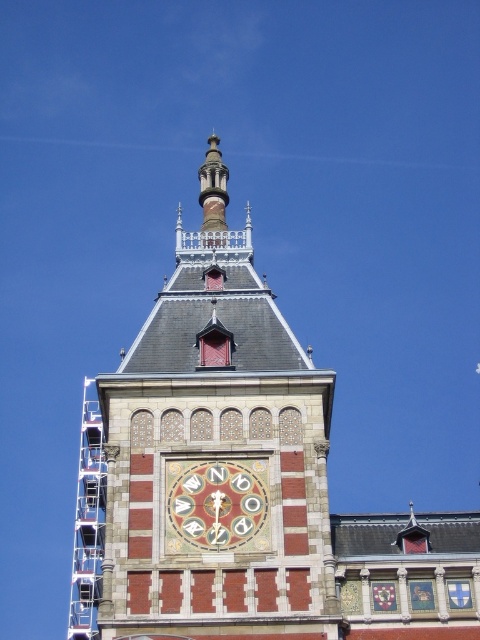
Can you confirm if brick clock tower at upper center is positioned below metal scaffolding at left?

Incorrect, brick clock tower at upper center is not positioned below metal scaffolding at left.

Is brick clock tower at upper center thinner than metal scaffolding at left?

No, brick clock tower at upper center is not thinner than metal scaffolding at left.

Which is in front, point (116, 520) or point (95, 598)?

Point (116, 520) is in front.

Find the location of a particular element. brick clock tower at upper center is located at coordinates (245, 464).

Does brick clock tower at upper center have a lesser width compared to marble clock face at center?

No.

The height and width of the screenshot is (640, 480). In order to click on brick clock tower at upper center in this screenshot , I will do (x=245, y=464).

Is marble clock face at center wider than metal scaffolding at left?

In fact, marble clock face at center might be narrower than metal scaffolding at left.

Does marble clock face at center have a lesser height compared to metal scaffolding at left?

Indeed, marble clock face at center has a lesser height compared to metal scaffolding at left.

You are a GUI agent. You are given a task and a screenshot of the screen. Output one action in this format:
    pyautogui.click(x=<x>, y=<y>)
    Task: Click on the marble clock face at center
    This screenshot has height=640, width=480.
    Given the screenshot: What is the action you would take?
    pyautogui.click(x=214, y=502)